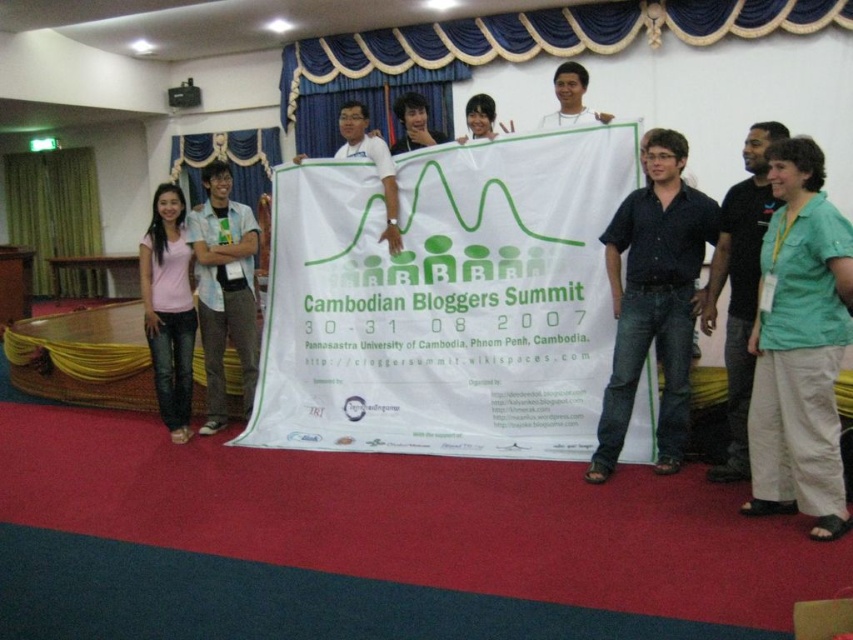
Question: Can you confirm if dark blue shirt at center is positioned to the right of white matte shirt at center?

Choices:
 (A) no
 (B) yes

Answer: (B)

Question: Is matte black shirt at center thinner than matte black hair at center?

Choices:
 (A) yes
 (B) no

Answer: (B)

Question: Which of the following is the closest to the observer?

Choices:
 (A) matte gray pants at left
 (B) white matte shirt at center
 (C) green shirt at right

Answer: (C)

Question: Based on their relative distances, which object is farther from the matte white shirt at center?

Choices:
 (A) dark blue shirt at center
 (B) white matte shirt at center

Answer: (B)

Question: Which point is closer to the camera?

Choices:
 (A) matte black hair at center
 (B) green shirt at right
 (C) green cotton shirt at center

Answer: (C)

Question: Is white paper banner at center wider than pink cotton shirt at left?

Choices:
 (A) yes
 (B) no

Answer: (A)